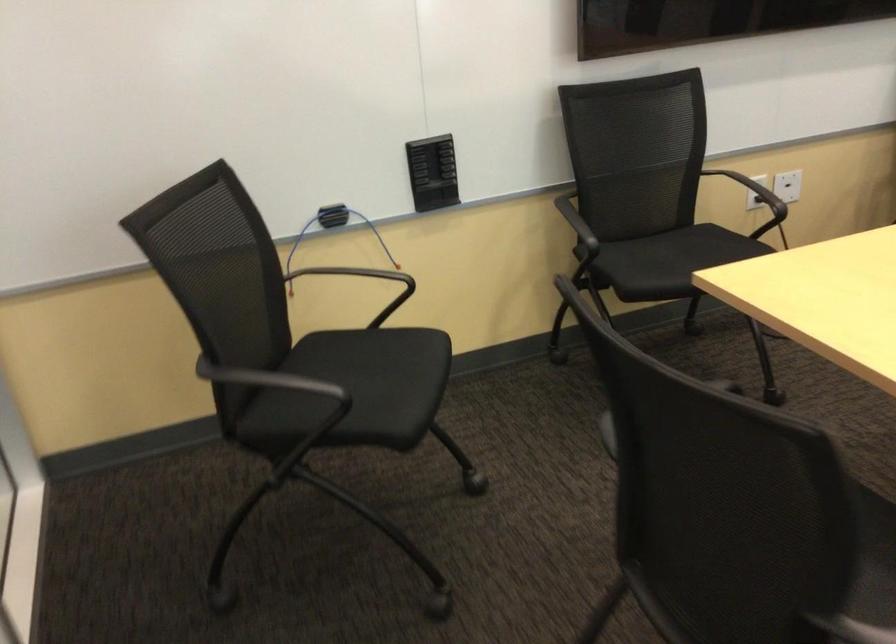
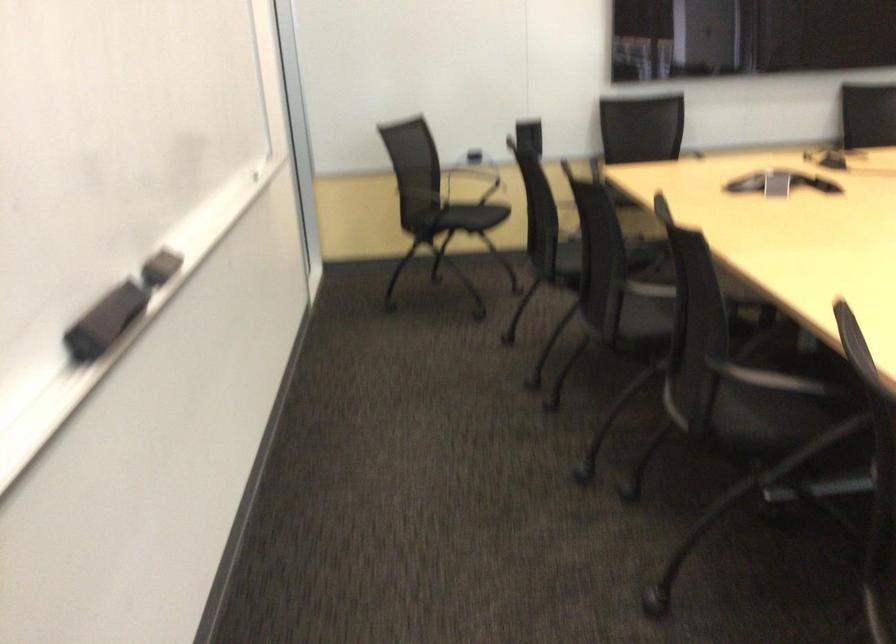
The point at [306,278] is marked in the first image. Where is the corresponding point in the second image?

(472, 180)